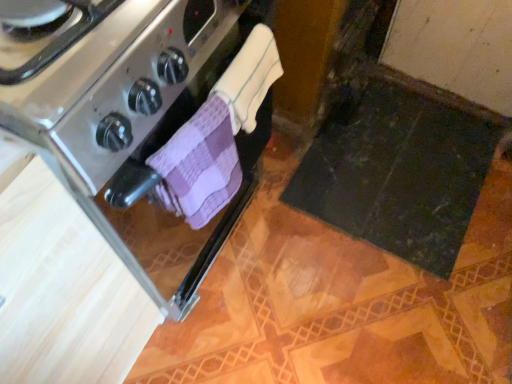
How much space does purple checkered cloth at center, marked as the 1th bath towel in a bottom-to-top arrangement, occupy horizontally?

purple checkered cloth at center, marked as the 1th bath towel in a bottom-to-top arrangement, is 7.58 centimeters wide.

Find the location of a particular element. purple checkered cloth at center, placed as the second bath towel when sorted from top to bottom is located at coordinates (199, 164).

From a real-world perspective, is purple checkered cloth at center, marked as the 1th bath towel in a bottom-to-top arrangement, physically below stainless steel oven at left?

Actually, purple checkered cloth at center, marked as the 1th bath towel in a bottom-to-top arrangement, is physically above stainless steel oven at left in the real world.

Are purple checkered cloth at center, placed as the second bath towel when sorted from top to bottom, and stainless steel oven at left beside each other?

No, purple checkered cloth at center, placed as the second bath towel when sorted from top to bottom, is not beside stainless steel oven at left.

What's the angular difference between purple checkered cloth at center, placed as the second bath towel when sorted from top to bottom, and stainless steel oven at left's facing directions?

The facing directions of purple checkered cloth at center, placed as the second bath towel when sorted from top to bottom, and stainless steel oven at left are 9.35 degrees apart.

Measure the distance from purple checkered cloth at center, marked as the 1th bath towel in a bottom-to-top arrangement, to stainless steel oven at left.

A distance of 5.07 inches exists between purple checkered cloth at center, marked as the 1th bath towel in a bottom-to-top arrangement, and stainless steel oven at left.

Does purple checkered cloth at center, marked as the 1th bath towel in a bottom-to-top arrangement, come in front of white terry cloth towel at center, which is counted as the 1th bath towel, starting from the top?

Yes, purple checkered cloth at center, marked as the 1th bath towel in a bottom-to-top arrangement, is closer to the viewer.

This screenshot has height=384, width=512. Identify the location of bath towel that is on the left side of white terry cloth towel at center, which is counted as the 1th bath towel, starting from the top. (199, 164).

Does point (225, 200) lie behind point (247, 41)?

Yes, it is.

Based on the photo, is purple checkered cloth at center, marked as the 1th bath towel in a bottom-to-top arrangement, next to white terry cloth towel at center, which is counted as the 1th bath towel, starting from the top?

Yes, purple checkered cloth at center, marked as the 1th bath towel in a bottom-to-top arrangement, and white terry cloth towel at center, which is counted as the 1th bath towel, starting from the top, clearly make contact.

In order to click on bath towel on the left side of white terry cloth towel at center, the 2th bath towel from the bottom in this screenshot , I will do `click(199, 164)`.

Which object is wider, white terry cloth towel at center, the 2th bath towel from the bottom, or purple checkered cloth at center, placed as the second bath towel when sorted from top to bottom?

Wider between the two is purple checkered cloth at center, placed as the second bath towel when sorted from top to bottom.

Looking at this image, is white terry cloth towel at center, the 2th bath towel from the bottom, at the right side of purple checkered cloth at center, placed as the second bath towel when sorted from top to bottom?

Correct, you'll find white terry cloth towel at center, the 2th bath towel from the bottom, to the right of purple checkered cloth at center, placed as the second bath towel when sorted from top to bottom.

Considering the sizes of white terry cloth towel at center, which is counted as the 1th bath towel, starting from the top, and purple checkered cloth at center, placed as the second bath towel when sorted from top to bottom, in the image, is white terry cloth towel at center, which is counted as the 1th bath towel, starting from the top, taller or shorter than purple checkered cloth at center, placed as the second bath towel when sorted from top to bottom,?

In the image, white terry cloth towel at center, which is counted as the 1th bath towel, starting from the top, appears to be shorter than purple checkered cloth at center, placed as the second bath towel when sorted from top to bottom.

Which is closer to the camera, (247, 171) or (211, 188)?

Point (247, 171) appears to be farther away from the viewer than point (211, 188).

Does stainless steel oven at left have a lesser height compared to purple checkered cloth at center, marked as the 1th bath towel in a bottom-to-top arrangement?

In fact, stainless steel oven at left may be taller than purple checkered cloth at center, marked as the 1th bath towel in a bottom-to-top arrangement.

Measure the distance from stainless steel oven at left to purple checkered cloth at center, marked as the 1th bath towel in a bottom-to-top arrangement.

stainless steel oven at left and purple checkered cloth at center, marked as the 1th bath towel in a bottom-to-top arrangement, are 12.89 centimeters apart.

You are a GUI agent. You are given a task and a screenshot of the screen. Output one action in this format:
    pyautogui.click(x=<x>, y=<y>)
    Task: Click on the 2nd bath towel behind the stainless steel oven at left, starting your count from the anchor
    
    Given the screenshot: What is the action you would take?
    pyautogui.click(x=249, y=78)

From the image's perspective, is white terry cloth towel at center, which is counted as the 1th bath towel, starting from the top, located above stainless steel oven at left?

Yes, from the image's perspective, white terry cloth towel at center, which is counted as the 1th bath towel, starting from the top, is above stainless steel oven at left.

Considering the positions of points (247, 115) and (168, 285), is point (247, 115) farther from camera compared to point (168, 285)?

No, it is not.

Is white terry cloth towel at center, the 2th bath towel from the bottom, positioned beyond the bounds of stainless steel oven at left?

Indeed, white terry cloth towel at center, the 2th bath towel from the bottom, is completely outside stainless steel oven at left.

Can you confirm if stainless steel oven at left is bigger than white terry cloth towel at center, which is counted as the 1th bath towel, starting from the top?

Yes.

Is stainless steel oven at left closer to the viewer compared to white terry cloth towel at center, the 2th bath towel from the bottom?

Yes, stainless steel oven at left is closer to the camera.

From a real-world perspective, which bath towel is the 1st one above the stainless steel oven at left? Please provide its 2D coordinates.

[(199, 164)]

Find the location of a particular element. The image size is (512, 384). bath towel lying in front of the white terry cloth towel at center, which is counted as the 1th bath towel, starting from the top is located at coordinates (199, 164).

When comparing their distances from purple checkered cloth at center, placed as the second bath towel when sorted from top to bottom, does white terry cloth towel at center, the 2th bath towel from the bottom, or stainless steel oven at left seem closer?

white terry cloth towel at center, the 2th bath towel from the bottom, lies closer to purple checkered cloth at center, placed as the second bath towel when sorted from top to bottom, than the other object.

Based on their spatial positions, is purple checkered cloth at center, placed as the second bath towel when sorted from top to bottom, or white terry cloth towel at center, the 2th bath towel from the bottom, further from stainless steel oven at left?

white terry cloth towel at center, the 2th bath towel from the bottom.

In the scene shown: Based on their spatial positions, is stainless steel oven at left or purple checkered cloth at center, placed as the second bath towel when sorted from top to bottom, further from white terry cloth towel at center, the 2th bath towel from the bottom?

stainless steel oven at left is further to white terry cloth towel at center, the 2th bath towel from the bottom.

From the picture: Which object lies nearer to the anchor point stainless steel oven at left, white terry cloth towel at center, the 2th bath towel from the bottom, or purple checkered cloth at center, placed as the second bath towel when sorted from top to bottom?

purple checkered cloth at center, placed as the second bath towel when sorted from top to bottom.

Based on their spatial positions, is purple checkered cloth at center, marked as the 1th bath towel in a bottom-to-top arrangement, or stainless steel oven at left further from white terry cloth towel at center, which is counted as the 1th bath towel, starting from the top?

The object further to white terry cloth towel at center, which is counted as the 1th bath towel, starting from the top, is stainless steel oven at left.

Consider the image. Which object lies nearer to the anchor point purple checkered cloth at center, marked as the 1th bath towel in a bottom-to-top arrangement, stainless steel oven at left or white terry cloth towel at center, the 2th bath towel from the bottom?

white terry cloth towel at center, the 2th bath towel from the bottom, lies closer to purple checkered cloth at center, marked as the 1th bath towel in a bottom-to-top arrangement, than the other object.

The height and width of the screenshot is (384, 512). What are the coordinates of `bath towel located between stainless steel oven at left and white terry cloth towel at center, which is counted as the 1th bath towel, starting from the top, in the left-right direction` in the screenshot? It's located at (199, 164).